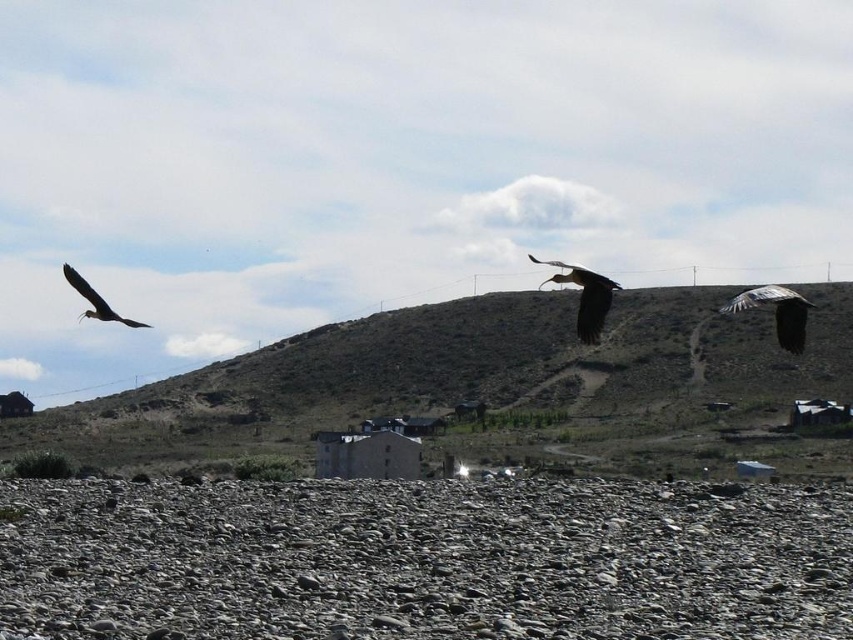
Question: Does dark brown feathered eagle at upper right have a greater width compared to shiny black bird at left?

Choices:
 (A) no
 (B) yes

Answer: (A)

Question: Among these objects, which one is nearest to the camera?

Choices:
 (A) gray gravelly rocks at lower center
 (B) dark brown feathered eagle at upper right

Answer: (A)

Question: Which point is farther to the camera?

Choices:
 (A) green grassy hillside at center
 (B) shiny black bird at left
 (C) gray gravelly rocks at lower center
 (D) dark brown feathered eagle at upper right

Answer: (B)

Question: Is gray gravelly rocks at lower center wider than shiny black bird at left?

Choices:
 (A) no
 (B) yes

Answer: (B)

Question: In this image, where is green grassy hillside at center located relative to white feathered bird at center?

Choices:
 (A) left
 (B) right

Answer: (A)

Question: Which point is closer to the camera?

Choices:
 (A) dark brown feathered eagle at upper right
 (B) shiny black bird at left

Answer: (A)